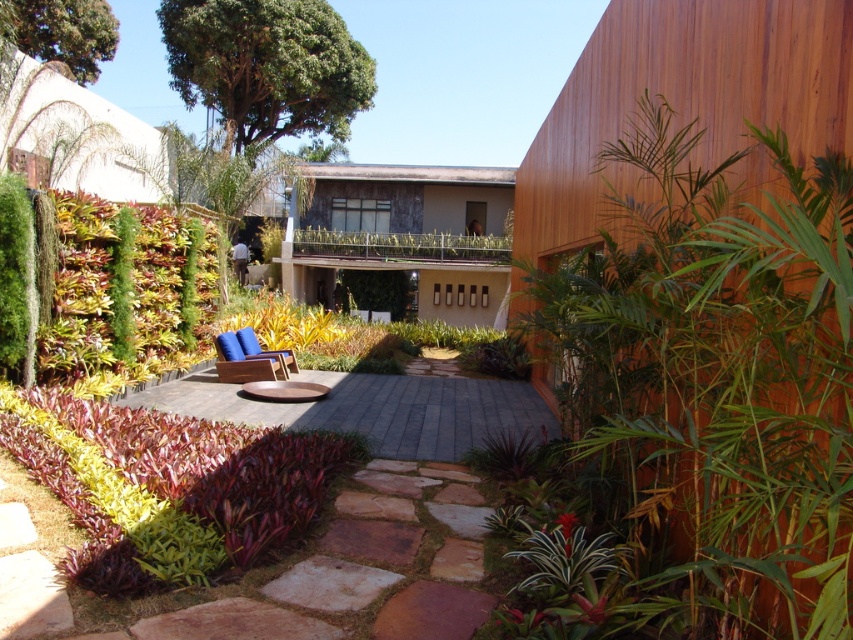
Question: Which object is positioned farthest from the green leafy hedge at left?

Choices:
 (A) wooden balcony at center
 (B) green leafy plant at right

Answer: (A)

Question: Estimate the real-world distances between objects in this image. Which object is closer to the green leafy hedge at left?

Choices:
 (A) wooden balcony at center
 (B) smooth stone path at center

Answer: (B)

Question: Is green leafy hedge at left positioned before smooth stone path at center?

Choices:
 (A) yes
 (B) no

Answer: (A)

Question: Based on their relative distances, which object is nearer to the green leafy plant at right?

Choices:
 (A) green leafy hedge at left
 (B) wooden balcony at center
 (C) smooth stone path at center

Answer: (C)

Question: Can you confirm if green leafy hedge at left is thinner than wooden balcony at center?

Choices:
 (A) yes
 (B) no

Answer: (A)

Question: Considering the relative positions of green leafy plant at right and blue fabric chair at center in the image provided, where is green leafy plant at right located with respect to blue fabric chair at center?

Choices:
 (A) below
 (B) above

Answer: (B)